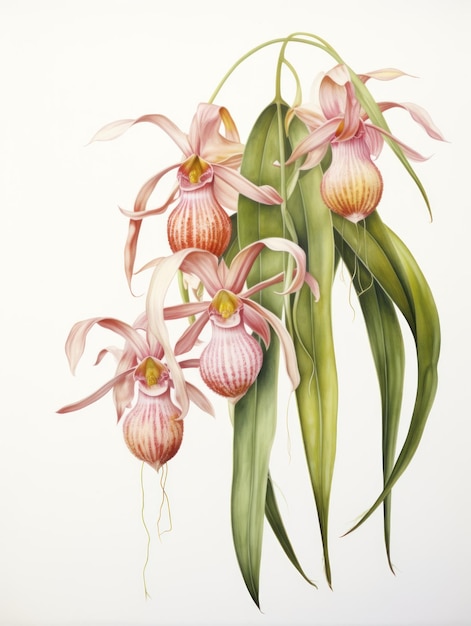
Locate an element on the screen. This screenshot has width=471, height=626. bulbs is located at coordinates (234, 349), (155, 418).